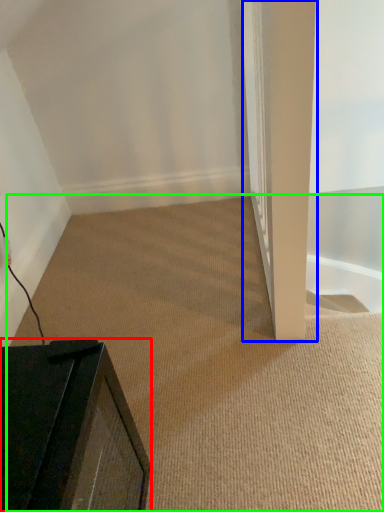
Question: Which is nearer to the furniture (highlighted by a red box)? pillar (highlighted by a blue box) or plain (highlighted by a green box).

Choices:
 (A) pillar
 (B) plain

Answer: (B)